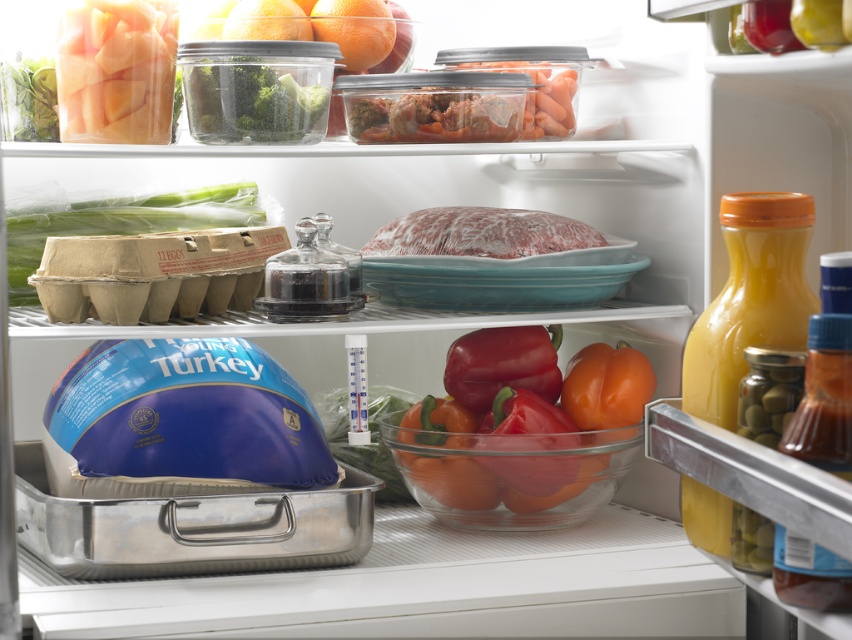
Question: Among these points, which one is farthest from the camera?

Choices:
 (A) (727, 332)
 (B) (586, 488)

Answer: (B)

Question: Which of the following is the farthest from the observer?

Choices:
 (A) (154, 92)
 (B) (249, 112)
 (C) (422, 474)

Answer: (C)

Question: Can you confirm if yellow glass bottle at right is positioned above frozen pinkish-red meat at center?

Choices:
 (A) no
 (B) yes

Answer: (A)

Question: Does green cardboard egg carton at left come behind frozen pinkish-red meat at center?

Choices:
 (A) yes
 (B) no

Answer: (A)

Question: Is translucent glass bell peppers at center to the left of translucent plastic peaches at upper left from the viewer's perspective?

Choices:
 (A) no
 (B) yes

Answer: (A)

Question: Considering the real-world distances, which object is farthest from the green cardboard egg carton at left?

Choices:
 (A) frozen pinkish-red meat at center
 (B) yellow glass bottle at right

Answer: (B)